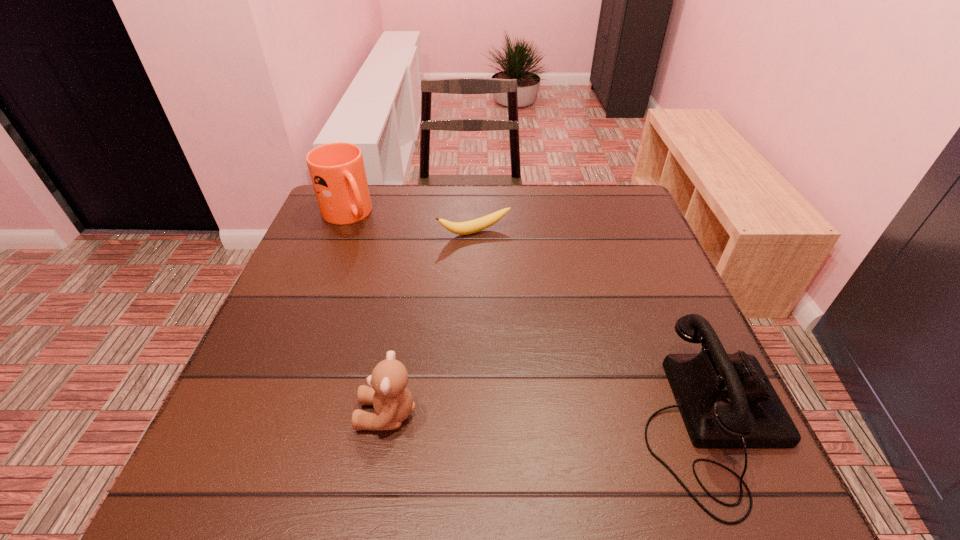
Locate an element on the screen. This screenshot has width=960, height=540. vacant space on the desktop that is between the teddy bear and the rightmost object and is positioned on the upward curve of the shortest object is located at coordinates (589, 419).

The width and height of the screenshot is (960, 540). I want to click on vacant space on the desktop that is between the teddy bear and the telephone and is positioned on the handle side of the mug, so click(549, 418).